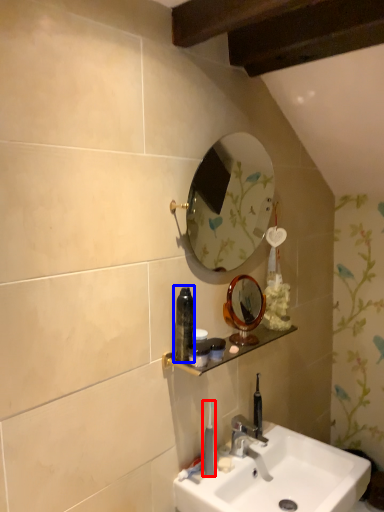
Question: Which object is closer to the camera taking this photo, toothbrush (highlighted by a red box) or mouthwash (highlighted by a blue box)?

Choices:
 (A) toothbrush
 (B) mouthwash

Answer: (B)